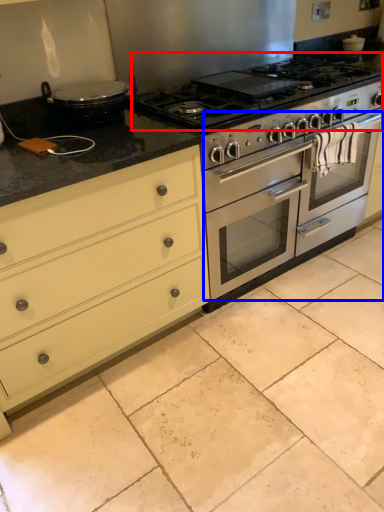
Question: Among these objects, which one is nearest to the camera, gas stove (highlighted by a red box) or oven (highlighted by a blue box)?

Choices:
 (A) gas stove
 (B) oven

Answer: (A)